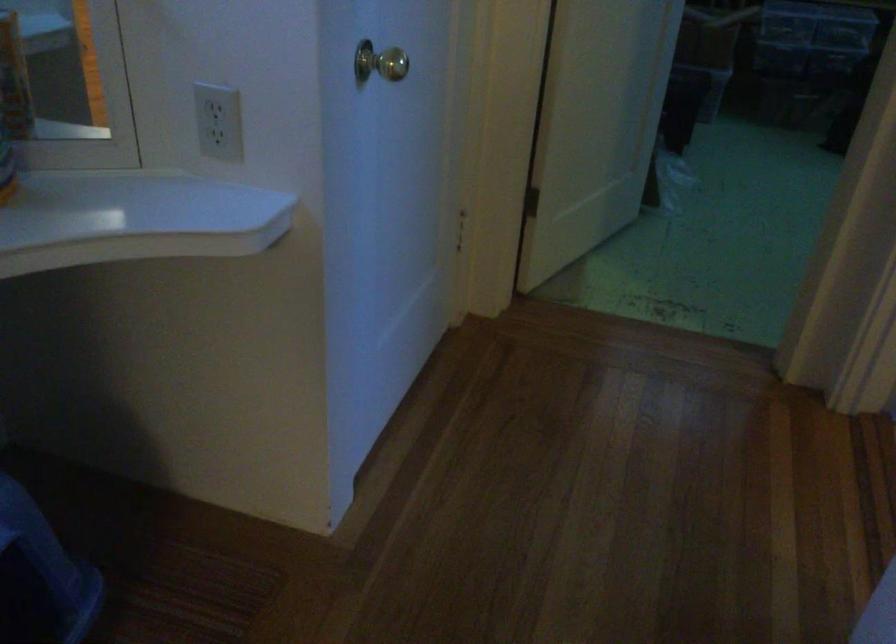
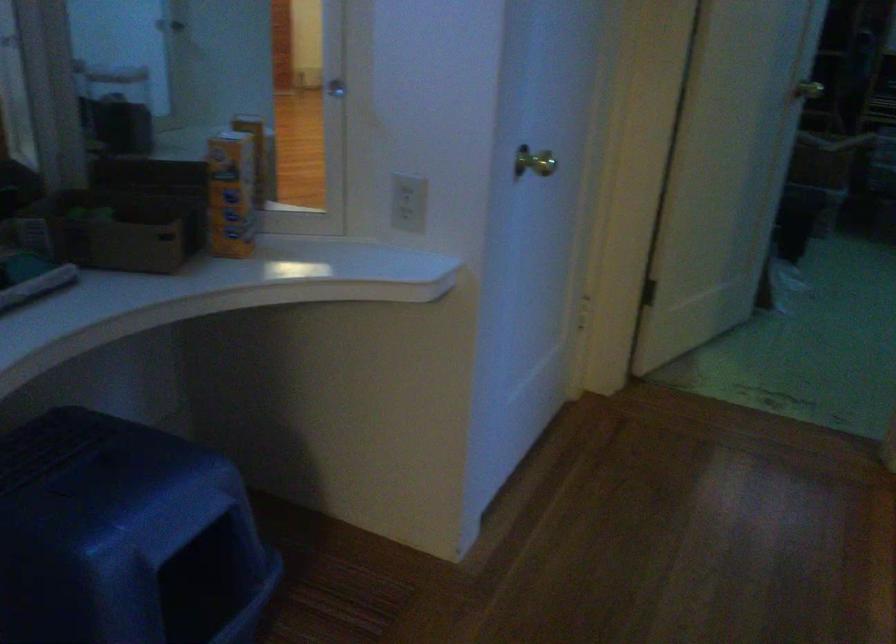
In the second image, find the point that corresponds to point 231,128 in the first image.

(409, 202)